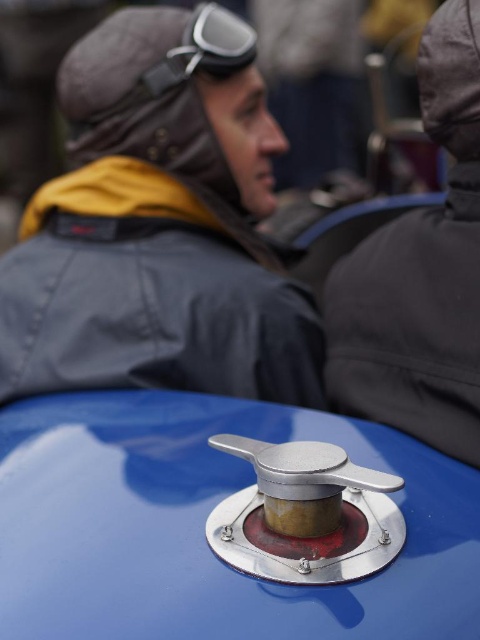
Who is taller, matte gray helmet at upper left or dark gray jacket at center?

matte gray helmet at upper left

Does matte gray helmet at upper left have a greater width compared to dark gray jacket at center?

Yes, matte gray helmet at upper left is wider than dark gray jacket at center.

In order to click on matte gray helmet at upper left in this screenshot , I will do `click(159, 225)`.

Between shiny metallic knob at center and dark gray jacket at center, which one appears on the right side from the viewer's perspective?

dark gray jacket at center

Can you confirm if shiny metallic knob at center is positioned above dark gray jacket at center?

Incorrect, shiny metallic knob at center is not positioned above dark gray jacket at center.

I want to click on shiny metallic knob at center, so click(204, 524).

Between matte gray helmet at upper left and shiny metallic knob at center, which one is positioned lower?

Positioned lower is shiny metallic knob at center.

Looking at this image, who is positioned more to the left, matte gray helmet at upper left or shiny metallic knob at center?

From the viewer's perspective, matte gray helmet at upper left appears more on the left side.

At what (x,y) coordinates should I click in order to perform the action: click on matte gray helmet at upper left. Please return your answer as a coordinate pair (x, y). This screenshot has width=480, height=640. Looking at the image, I should click on 159,225.